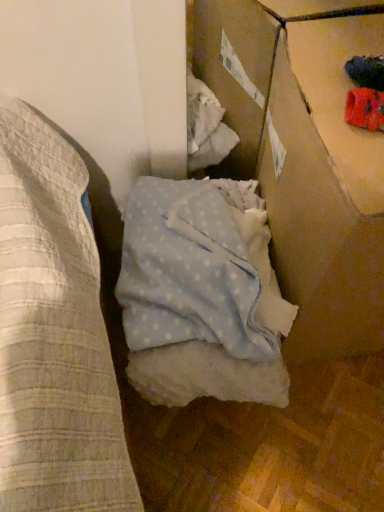
Question: Is cardboard box at upper right not near light blue polka dot fabric at center?

Choices:
 (A) no
 (B) yes

Answer: (A)

Question: Considering the relative sizes of cardboard box at upper right and light blue polka dot fabric at center in the image provided, is cardboard box at upper right smaller than light blue polka dot fabric at center?

Choices:
 (A) no
 (B) yes

Answer: (A)

Question: Would you say light blue polka dot fabric at center is part of cardboard box at upper right's contents?

Choices:
 (A) yes
 (B) no

Answer: (B)

Question: Could you tell me if cardboard box at upper right is facing light blue polka dot fabric at center?

Choices:
 (A) yes
 (B) no

Answer: (B)

Question: Is cardboard box at upper right shorter than light blue polka dot fabric at center?

Choices:
 (A) yes
 (B) no

Answer: (B)

Question: Does cardboard box at upper right appear on the right side of light blue polka dot fabric at center?

Choices:
 (A) yes
 (B) no

Answer: (A)

Question: Is light blue polka dot fabric at center outside cardboard box at upper right?

Choices:
 (A) yes
 (B) no

Answer: (A)

Question: Is cardboard box at upper right completely or partially inside light blue polka dot fabric at center?

Choices:
 (A) no
 (B) yes

Answer: (A)

Question: Is light blue polka dot fabric at center placed right next to cardboard box at upper right?

Choices:
 (A) no
 (B) yes

Answer: (A)

Question: Is light blue polka dot fabric at center looking in the opposite direction of cardboard box at upper right?

Choices:
 (A) no
 (B) yes

Answer: (A)

Question: Does light blue polka dot fabric at center have a greater width compared to cardboard box at upper right?

Choices:
 (A) yes
 (B) no

Answer: (A)

Question: Considering the relative positions of light blue polka dot fabric at center and cardboard box at upper right in the image provided, is light blue polka dot fabric at center to the right of cardboard box at upper right from the viewer's perspective?

Choices:
 (A) no
 (B) yes

Answer: (A)

Question: In the image, is light blue polka dot fabric at center on the left side or the right side of cardboard box at upper right?

Choices:
 (A) left
 (B) right

Answer: (A)